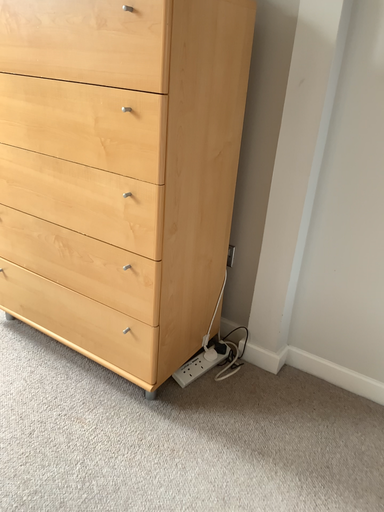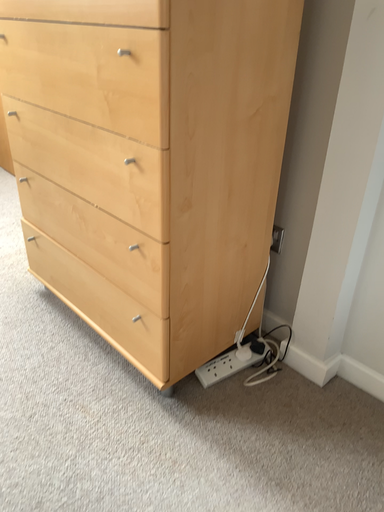
Question: How did the camera likely rotate when shooting the video?

Choices:
 (A) rotated right
 (B) rotated left

Answer: (B)